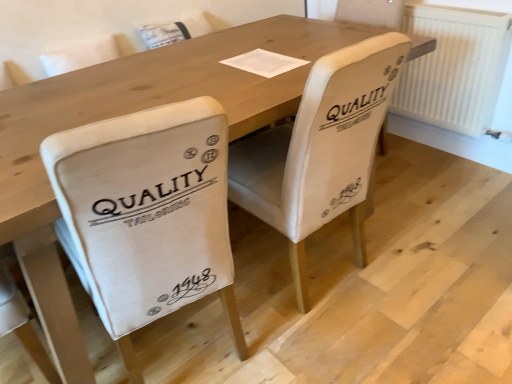
Identify the location of vacant space in white paper at center (from a real-world perspective). Image resolution: width=512 pixels, height=384 pixels. (254, 57).